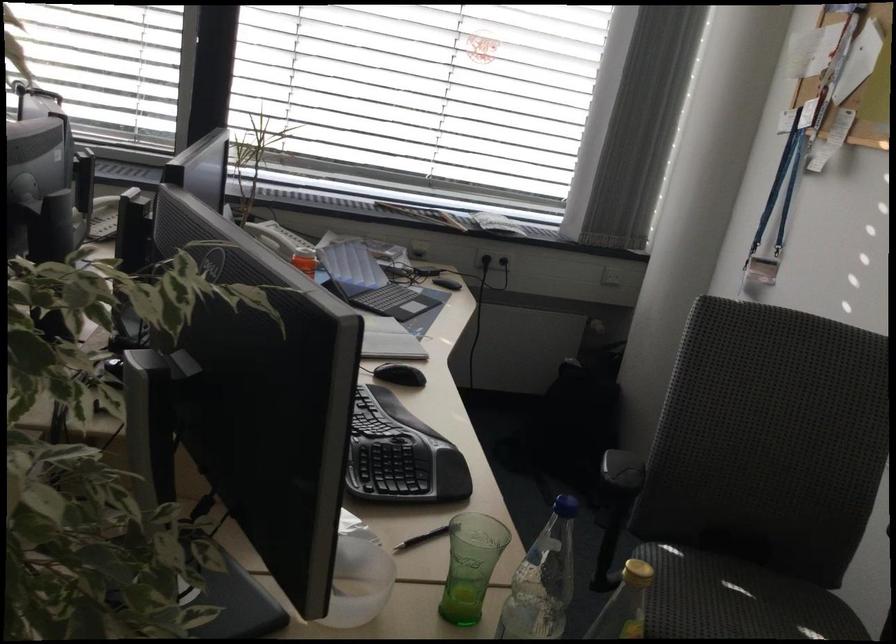
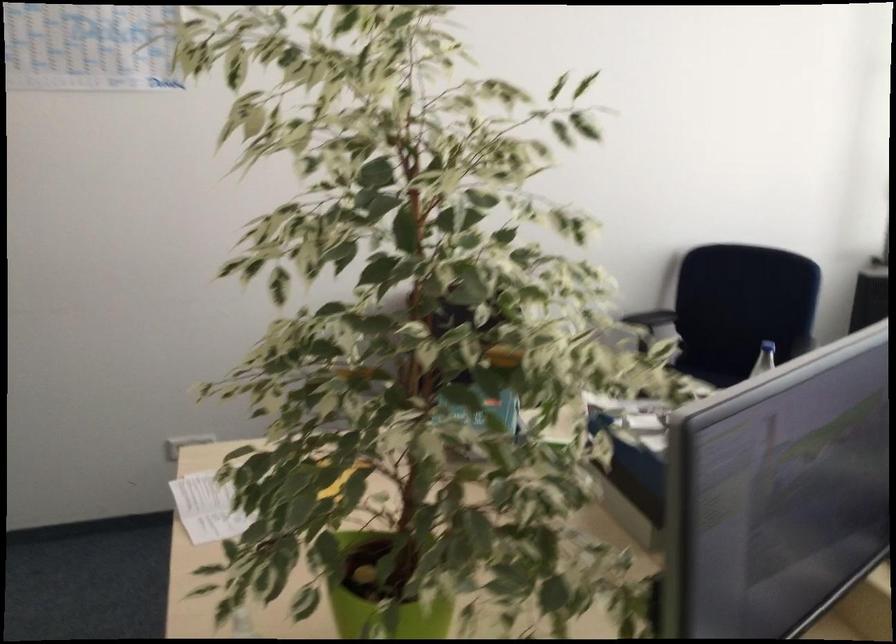
Question: The images are taken continuously from a first-person perspective. In which direction is your viewpoint rotating?

Choices:
 (A) Left
 (B) Right
 (C) Up
 (D) Down

Answer: (A)